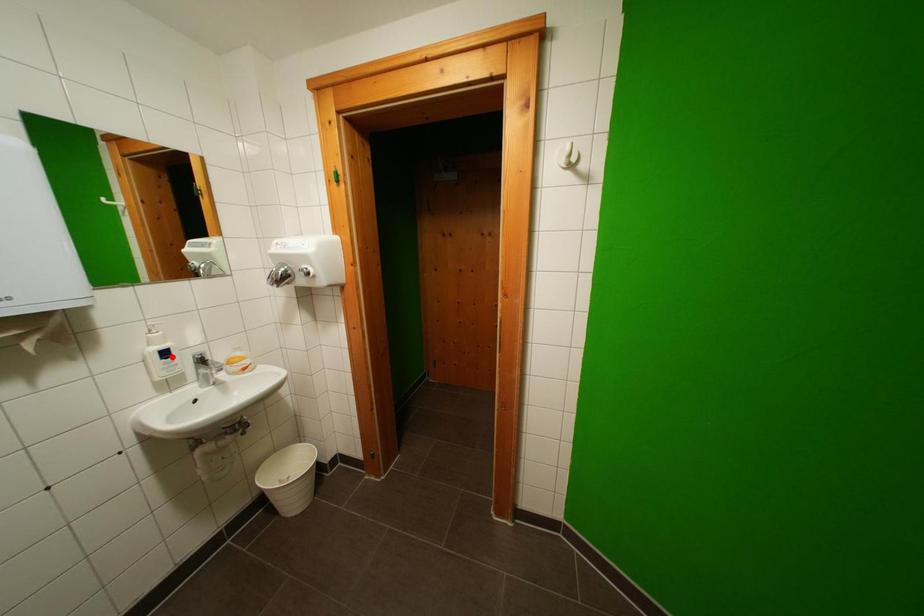
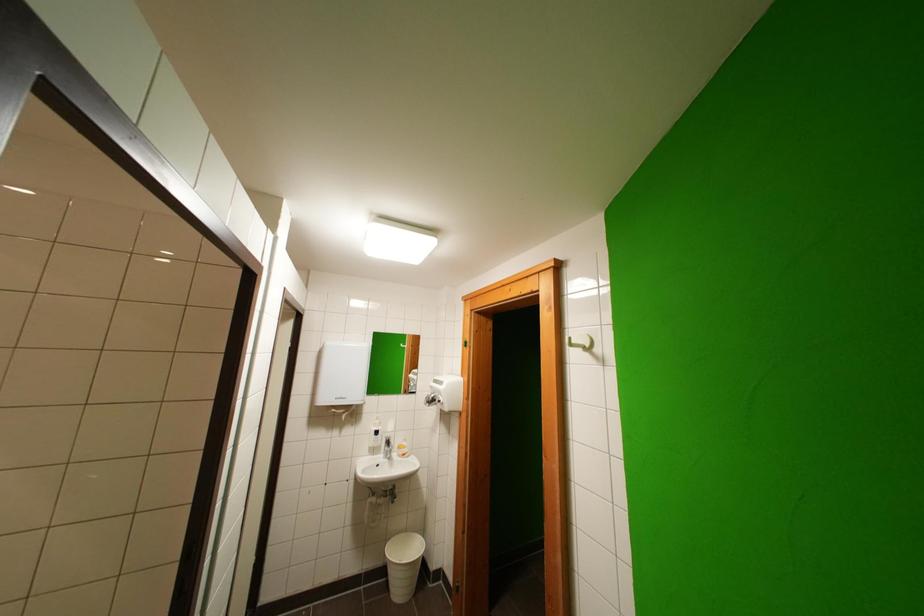
The point at the highlighted location is marked in the first image. Where is the corresponding point in the second image?

(383, 436)